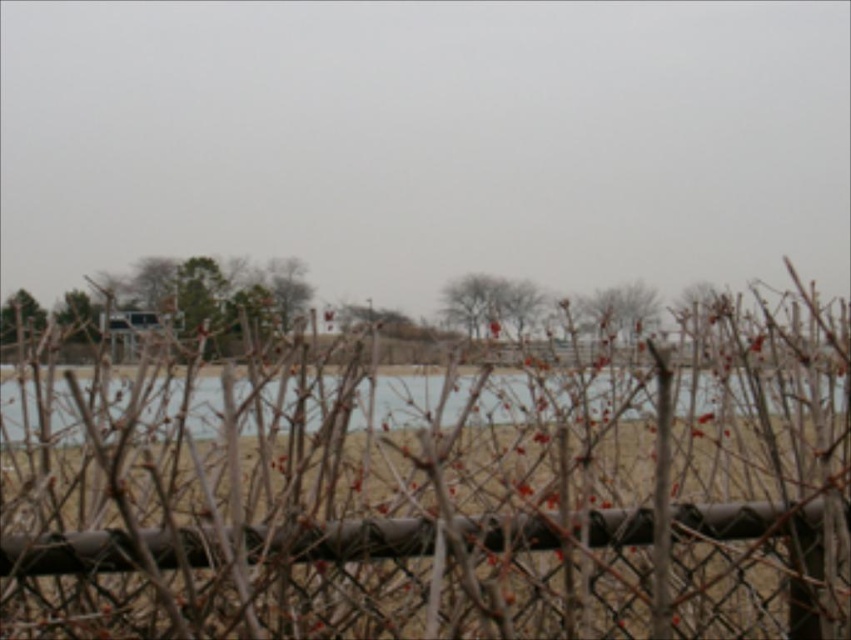
Question: Which point is closer to the camera?

Choices:
 (A) metallic chain-link fence at center
 (B) brown matte tree at upper center

Answer: (A)

Question: Which object is positioned closest to the brown matte tree at upper center?

Choices:
 (A) clear water at center
 (B) brown textured tree at left
 (C) metallic chain-link fence at center

Answer: (A)

Question: Can you confirm if metallic chain-link fence at center is thinner than clear water at center?

Choices:
 (A) no
 (B) yes

Answer: (B)

Question: Can you confirm if bare branches at center is wider than brown textured tree at left?

Choices:
 (A) yes
 (B) no

Answer: (B)

Question: Which point is closer to the camera taking this photo?

Choices:
 (A) (603, 404)
 (B) (523, 316)
 (C) (817, 566)

Answer: (C)

Question: Is metallic chain-link fence at center smaller than clear water at center?

Choices:
 (A) no
 (B) yes

Answer: (B)